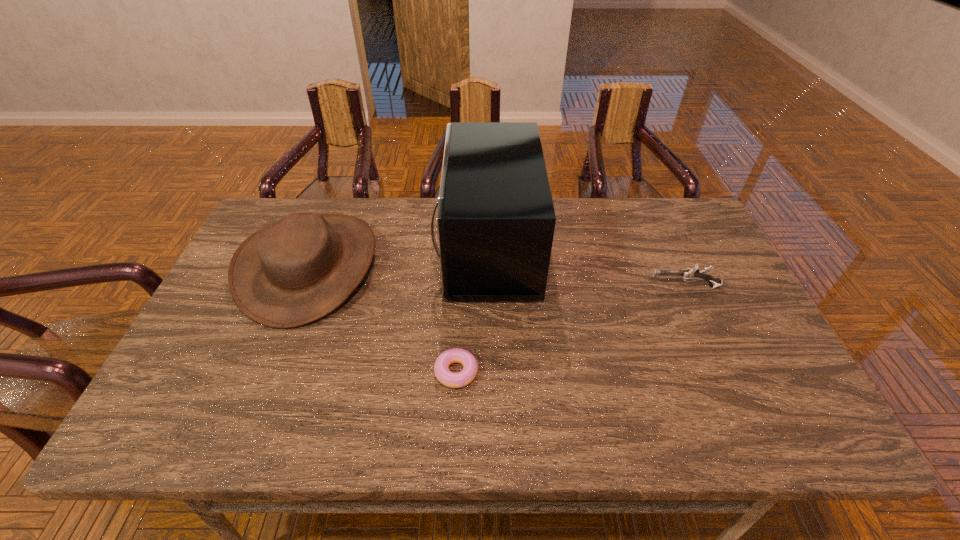
You are a GUI agent. You are given a task and a screenshot of the screen. Output one action in this format:
    pyautogui.click(x=<x>, y=<y>)
    Task: Click on the vacant space located on the right of the cowboy hat
    The height and width of the screenshot is (540, 960).
    Given the screenshot: What is the action you would take?
    pyautogui.click(x=511, y=266)

Where is `vacant space located 0.100m aimed along the barrel of the rightmost object`? The width and height of the screenshot is (960, 540). vacant space located 0.100m aimed along the barrel of the rightmost object is located at coordinates [612, 287].

The image size is (960, 540). I want to click on free space located 0.220m aimed along the barrel of the rightmost object, so click(x=569, y=287).

Find the location of a particular element. The width and height of the screenshot is (960, 540). vacant space located aimed along the barrel of the rightmost object is located at coordinates (540, 287).

The width and height of the screenshot is (960, 540). What are the coordinates of `free space located on the back of the doughnut` in the screenshot? It's located at (459, 313).

Locate an element on the screen. The height and width of the screenshot is (540, 960). microwave oven located at the far edge is located at coordinates (495, 220).

Locate an element on the screen. The height and width of the screenshot is (540, 960). cowboy hat that is at the far edge is located at coordinates (x=300, y=268).

What are the coordinates of `object that is at the left edge` in the screenshot? It's located at (300, 268).

You are a GUI agent. You are given a task and a screenshot of the screen. Output one action in this format:
    pyautogui.click(x=<x>, y=<y>)
    Task: Click on the object that is at the right edge
    Image resolution: width=960 pixels, height=540 pixels.
    Given the screenshot: What is the action you would take?
    pyautogui.click(x=692, y=274)

The height and width of the screenshot is (540, 960). I want to click on object at the far left corner, so click(300, 268).